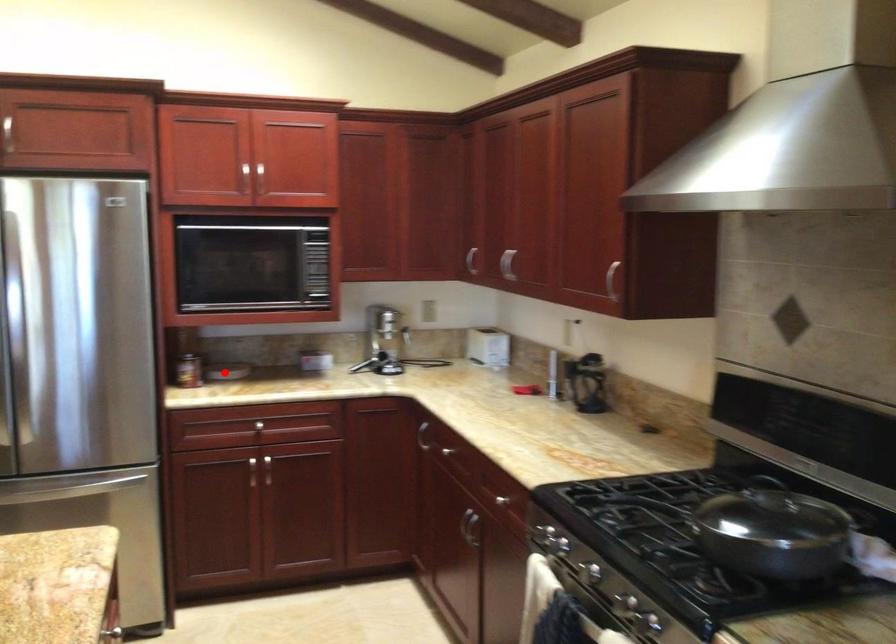
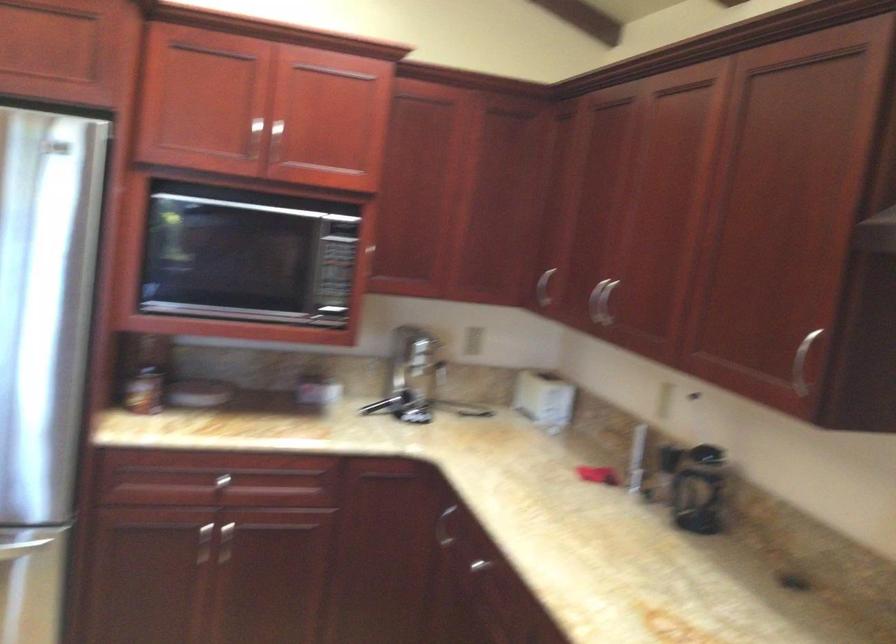
Question: I am providing you with two images of the same scene from different viewpoints. A red point is marked on the first image. Is the red point's position out of view in image 2?

Choices:
 (A) Yes
 (B) No

Answer: (B)